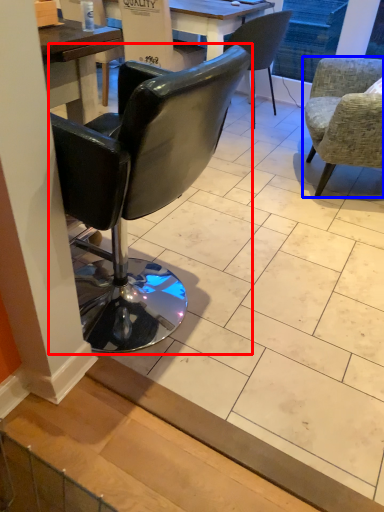
Question: Among these objects, which one is farthest to the camera, chair (highlighted by a red box) or chair (highlighted by a blue box)?

Choices:
 (A) chair
 (B) chair

Answer: (B)